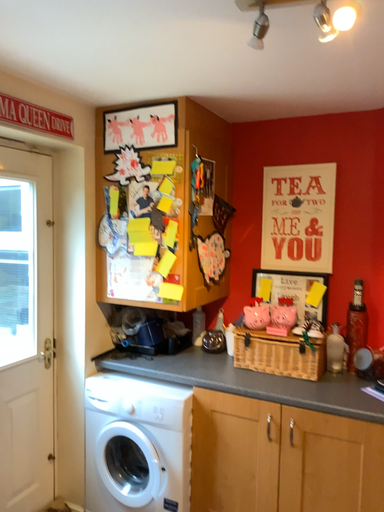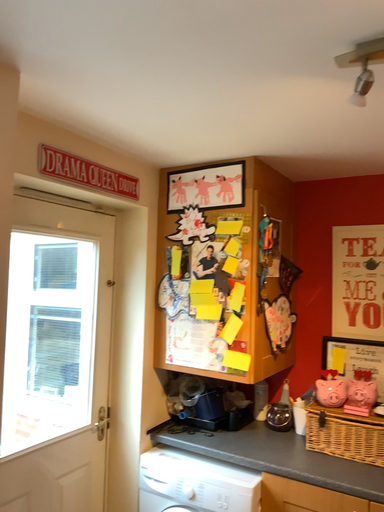
Question: Which way did the camera rotate in the video?

Choices:
 (A) rotated downward
 (B) rotated upward

Answer: (B)